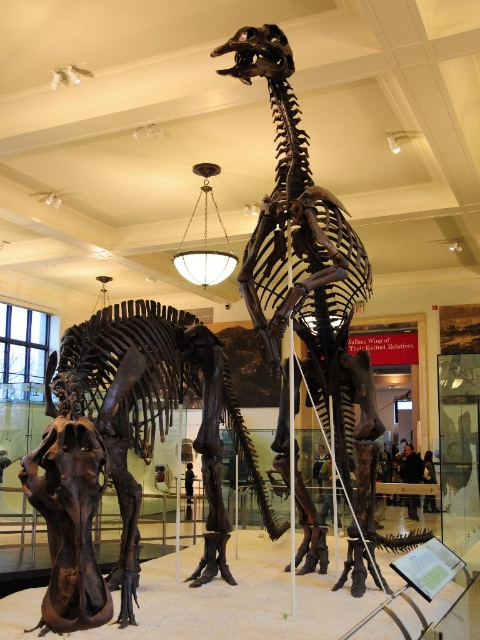
Question: Is shiny brown dinosaur at center in front of brown bone dinosaur at center?

Choices:
 (A) no
 (B) yes

Answer: (B)

Question: Which point is farther to the camera?

Choices:
 (A) (248, 308)
 (B) (84, 378)

Answer: (A)

Question: Among these points, which one is nearest to the camera?

Choices:
 (A) (332, 332)
 (B) (106, 360)

Answer: (B)

Question: Is shiny brown dinosaur at center further to camera compared to brown bone dinosaur at center?

Choices:
 (A) yes
 (B) no

Answer: (B)

Question: From the image, what is the correct spatial relationship of shiny brown dinosaur at center in relation to brown bone dinosaur at center?

Choices:
 (A) left
 (B) right

Answer: (A)